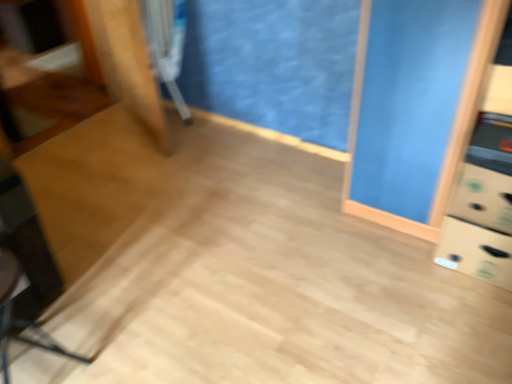
Question: Considering the positions of metallic silver swivel chair at upper left, acting as the 2th swivel chair starting from the front, and black plastic swivel chair at lower left, which is counted as the 2th swivel chair, starting from the top, in the image, is metallic silver swivel chair at upper left, acting as the 2th swivel chair starting from the front, taller or shorter than black plastic swivel chair at lower left, which is counted as the 2th swivel chair, starting from the top,?

Choices:
 (A) short
 (B) tall

Answer: (B)

Question: From a real-world perspective, is metallic silver swivel chair at upper left, arranged as the 1th swivel chair when viewed from the back, positioned above or below black plastic swivel chair at lower left, marked as the 1th swivel chair in a front-to-back arrangement?

Choices:
 (A) below
 (B) above

Answer: (B)

Question: Is metallic silver swivel chair at upper left, arranged as the 1th swivel chair when viewed from the back, in front of or behind black plastic swivel chair at lower left, which appears as the 2th swivel chair when viewed from the back, in the image?

Choices:
 (A) behind
 (B) front

Answer: (A)

Question: In terms of height, does black plastic swivel chair at lower left, the 1th swivel chair in the bottom-to-top sequence, look taller or shorter compared to metallic silver swivel chair at upper left, which appears as the 1th swivel chair when viewed from the top?

Choices:
 (A) short
 (B) tall

Answer: (A)

Question: From the image's perspective, is black plastic swivel chair at lower left, marked as the 1th swivel chair in a front-to-back arrangement, positioned above or below metallic silver swivel chair at upper left, arranged as the 1th swivel chair when viewed from the back?

Choices:
 (A) below
 (B) above

Answer: (A)

Question: From a real-world perspective, relative to metallic silver swivel chair at upper left, arranged as the 1th swivel chair when viewed from the back, is black plastic swivel chair at lower left, which appears as the 2th swivel chair when viewed from the back, vertically above or below?

Choices:
 (A) above
 (B) below

Answer: (B)

Question: Is black plastic swivel chair at lower left, marked as the 1th swivel chair in a front-to-back arrangement, situated inside metallic silver swivel chair at upper left, which appears as the 1th swivel chair when viewed from the top, or outside?

Choices:
 (A) inside
 (B) outside

Answer: (B)